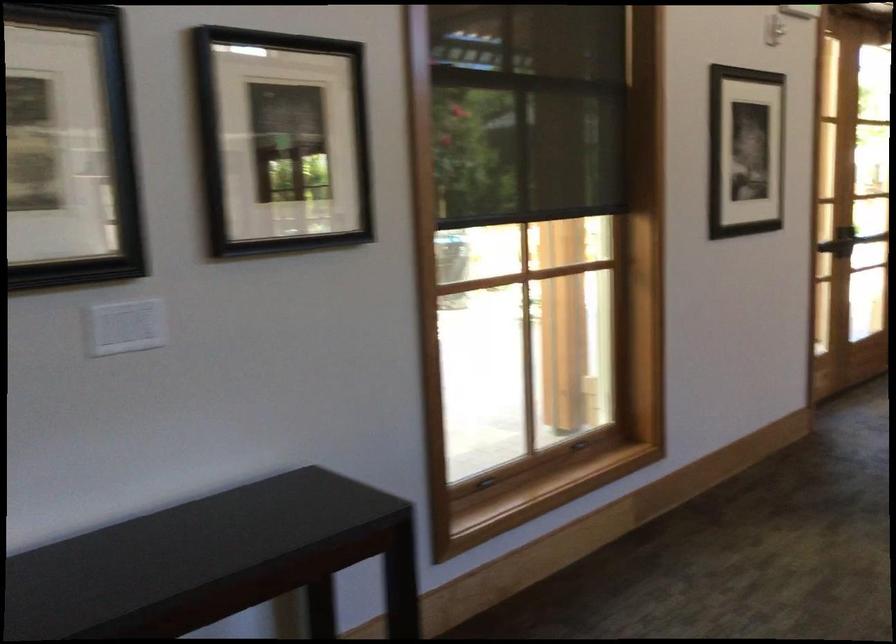
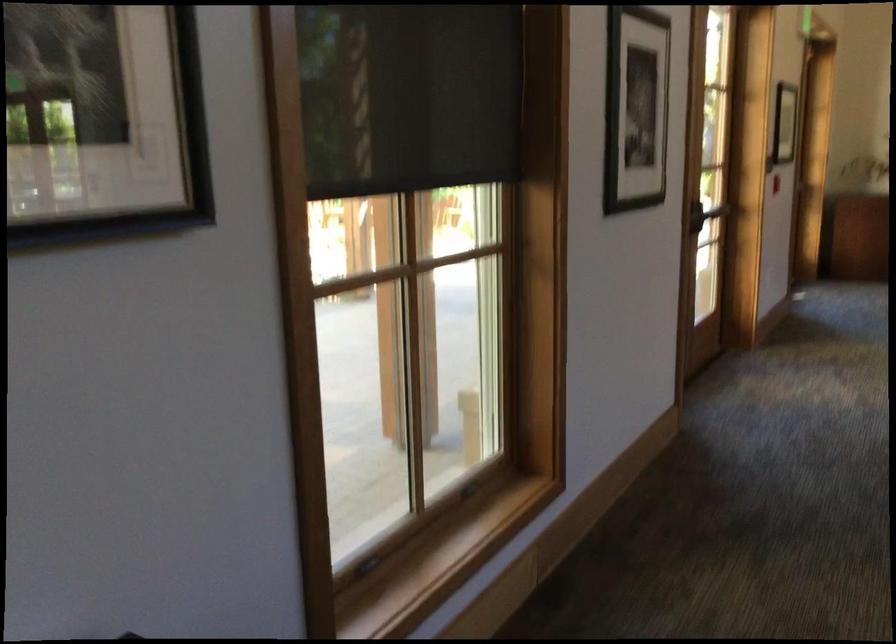
Question: The images are taken continuously from a first-person perspective. In which direction is your viewpoint rotating?

Choices:
 (A) Left
 (B) Right
 (C) Up
 (D) Down

Answer: (B)